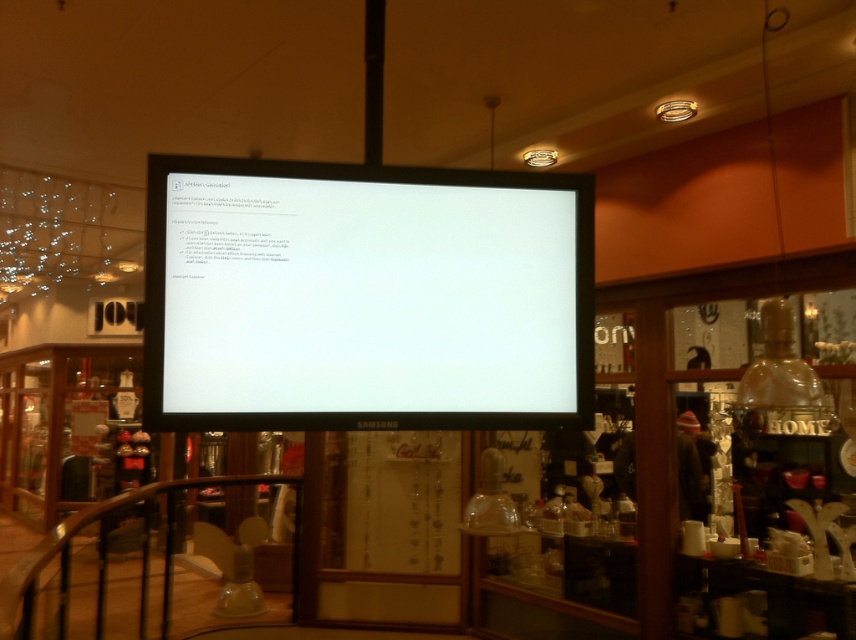
Looking at this image, you are a customer in this store and want to look at both the white glossy monitor at center and the black metal railing at lower left. Which object should you move towards first to see both without needing to turn around?

You should move towards the black metal railing at lower left first because the white glossy monitor at center is positioned on the right side of it, allowing you to see both objects by facing the same direction.

You are standing in the retail store and want to determine which of the two points, point (321,179) or point (33,560), is nearer to you. Based on the scene description, which point is closer?

Point (321,179) is closer to the viewer than point (33,560).